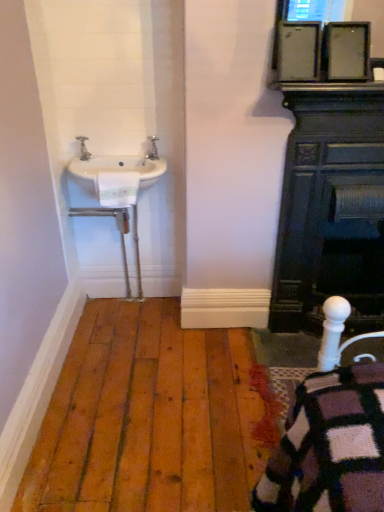
Question: In terms of height, does polished brass faucet at upper left, the second tap when ordered from left to right, look taller or shorter compared to white ceramic sink at left?

Choices:
 (A) tall
 (B) short

Answer: (B)

Question: Considering the positions of polished brass faucet at upper left, the 1th tap in the right-to-left sequence, and white ceramic sink at left in the image, is polished brass faucet at upper left, the 1th tap in the right-to-left sequence, wider or thinner than white ceramic sink at left?

Choices:
 (A) wide
 (B) thin

Answer: (B)

Question: Estimate the real-world distances between objects in this image. Which object is farther from the natural wood floor at lower left?

Choices:
 (A) black cast iron fireplace at right
 (B) polished brass faucet at upper left, the 1th tap in the right-to-left sequence
 (C) silver metallic tap at upper left, which is the 2th tap from right to left
 (D) white ceramic sink at left

Answer: (C)

Question: Which object is positioned closest to the silver metallic tap at upper left, the first tap from the left?

Choices:
 (A) natural wood floor at lower left
 (B) polished brass faucet at upper left, the 1th tap in the right-to-left sequence
 (C) black cast iron fireplace at right
 (D) white ceramic sink at left

Answer: (D)